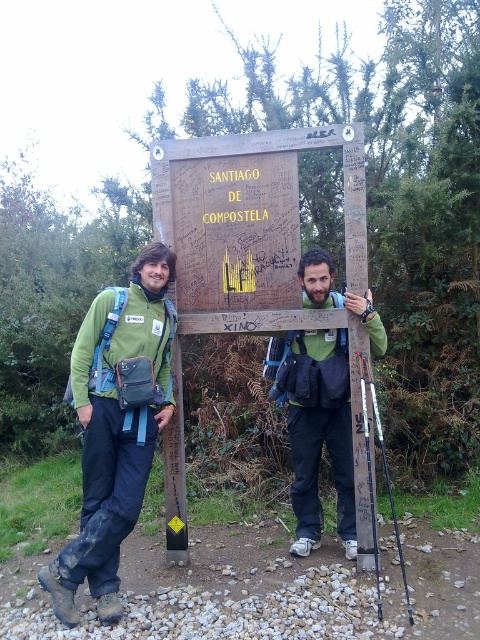
Who is lower down, green fabric backpack at center or black plastic ski pole at right?

black plastic ski pole at right is lower down.

Does green fabric backpack at center have a greater height compared to black plastic ski pole at right?

Indeed, green fabric backpack at center has a greater height compared to black plastic ski pole at right.

Where is `green fabric backpack at center`? Image resolution: width=480 pixels, height=640 pixels. green fabric backpack at center is located at coordinates (115, 433).

Is green fabric jacket at left thinner than green matte jacket at center?

Yes.

Where is `green fabric jacket at left`? green fabric jacket at left is located at coordinates (115, 432).

Locate an element on the screen. green fabric jacket at left is located at coordinates (115, 432).

Between green matte jacket at center and black plastic ski pole at right, which one is positioned higher?

green matte jacket at center

Does point (339, 353) come closer to viewer compared to point (372, 524)?

No.

The width and height of the screenshot is (480, 640). I want to click on green matte jacket at center, so click(x=317, y=429).